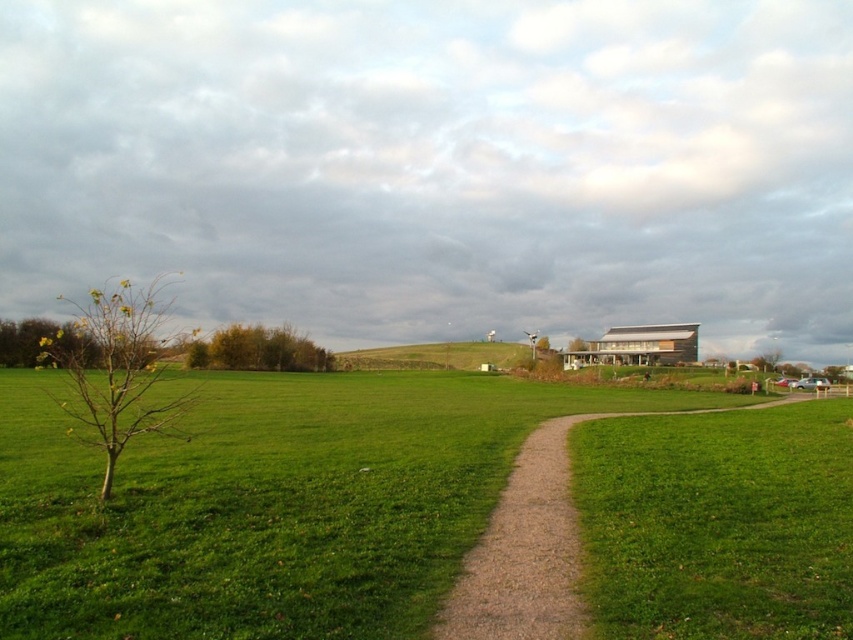
You are standing at the start of the dirt path and want to reach the modern building in the background. Which object, the green grassy at lower left or the green leafy tree at center, would you encounter first as you walk along the path?

The green grassy at lower left is closer to the viewer than the green leafy tree at center, so you would encounter the green grassy at lower left first as you walk along the path.

You are a hiker planning to walk from the green grassy at lower left to the green grassy hill at center. Given that your average walking speed is 3.5 km per hour, how long would it take you to reach the hill?

The distance between the green grassy at lower left and the green grassy hill at center is 101.89 meters. Converting this to kilometers gives 0.10189 km. Dividing by the walking speed of 3.5 km per hour yields approximately 0.0291 hours, which is roughly 1.75 minutes. Therefore, it would take about 1.75 minutes to reach the hill.